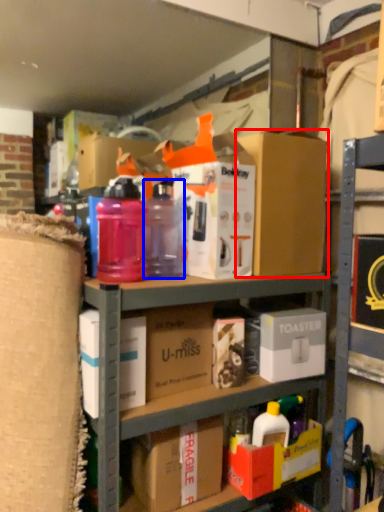
Question: Which of the following is the closest to the observer, box (highlighted by a red box) or bottle (highlighted by a blue box)?

Choices:
 (A) box
 (B) bottle

Answer: (B)